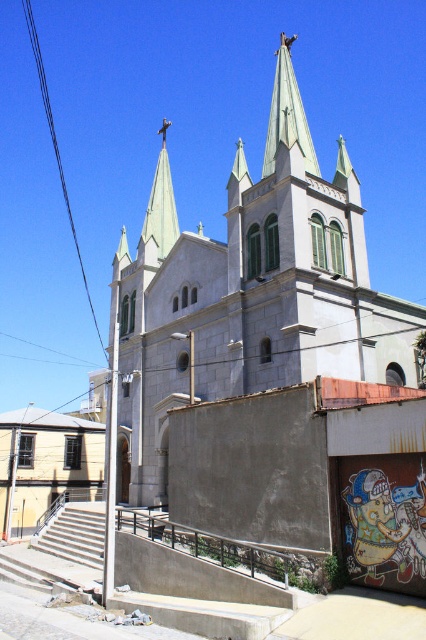
Does white stone church at center appear under green metallic steeple at center?

Correct, white stone church at center is located below green metallic steeple at center.

Locate an element on the screen. white stone church at center is located at coordinates (252, 300).

Who is taller, green metallic spire at upper center or black wire at upper left?

With more height is black wire at upper left.

Describe the element at coordinates (161, 204) in the screenshot. I see `green metallic spire at upper center` at that location.

Locate an element on the screen. green metallic spire at upper center is located at coordinates (161, 204).

I want to click on white stone church at center, so click(x=252, y=300).

Where is `white stone church at center`? The height and width of the screenshot is (640, 426). white stone church at center is located at coordinates (252, 300).